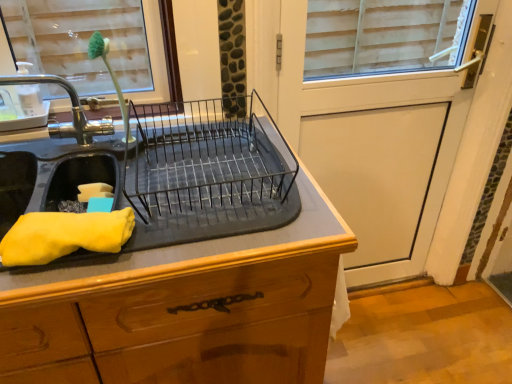
Question: Is white matte screen door at upper right far from black metal dish rack at center?

Choices:
 (A) no
 (B) yes

Answer: (A)

Question: Is white matte screen door at upper right further to camera compared to black metal dish rack at center?

Choices:
 (A) yes
 (B) no

Answer: (A)

Question: Could you tell me if white matte screen door at upper right is turned towards black metal dish rack at center?

Choices:
 (A) no
 (B) yes

Answer: (A)

Question: Is white matte screen door at upper right facing away from black metal dish rack at center?

Choices:
 (A) yes
 (B) no

Answer: (B)

Question: Can you confirm if white matte screen door at upper right is bigger than black metal dish rack at center?

Choices:
 (A) no
 (B) yes

Answer: (B)

Question: From the image's perspective, relative to yellow fabric at left, is white matte screen door at upper right above or below?

Choices:
 (A) below
 (B) above

Answer: (B)

Question: Is point (439, 155) positioned closer to the camera than point (74, 221)?

Choices:
 (A) farther
 (B) closer

Answer: (A)

Question: Do you think white matte screen door at upper right is within yellow fabric at left, or outside of it?

Choices:
 (A) outside
 (B) inside

Answer: (A)

Question: In terms of height, does white matte screen door at upper right look taller or shorter compared to yellow fabric at left?

Choices:
 (A) short
 (B) tall

Answer: (B)

Question: From the image's perspective, is black rubber mat at center above or below brushed metal tap at left?

Choices:
 (A) above
 (B) below

Answer: (B)

Question: Considering their positions, is black rubber mat at center located in front of or behind brushed metal tap at left?

Choices:
 (A) behind
 (B) front

Answer: (B)

Question: Is black rubber mat at center taller or shorter than brushed metal tap at left?

Choices:
 (A) tall
 (B) short

Answer: (A)

Question: In terms of width, does black rubber mat at center look wider or thinner when compared to brushed metal tap at left?

Choices:
 (A) wide
 (B) thin

Answer: (A)

Question: From a real-world perspective, is black metal dish rack at center physically located above or below white matte screen door at upper right?

Choices:
 (A) above
 (B) below

Answer: (A)

Question: Is black metal dish rack at center situated inside white matte screen door at upper right or outside?

Choices:
 (A) inside
 (B) outside

Answer: (B)